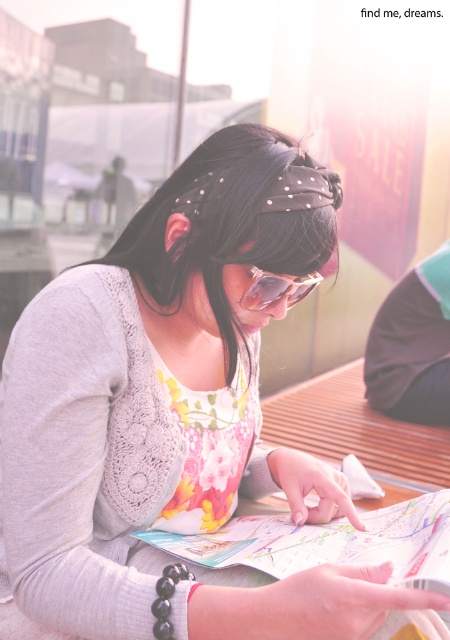
Does dark fabric at lower right appear on the left side of sunglasses at center?

No, dark fabric at lower right is not to the left of sunglasses at center.

Can you confirm if dark fabric at lower right is smaller than sunglasses at center?

No.

Where is `dark fabric at lower right`? Image resolution: width=450 pixels, height=640 pixels. dark fabric at lower right is located at coordinates (413, 346).

This screenshot has width=450, height=640. Identify the location of dark fabric at lower right. (413, 346).